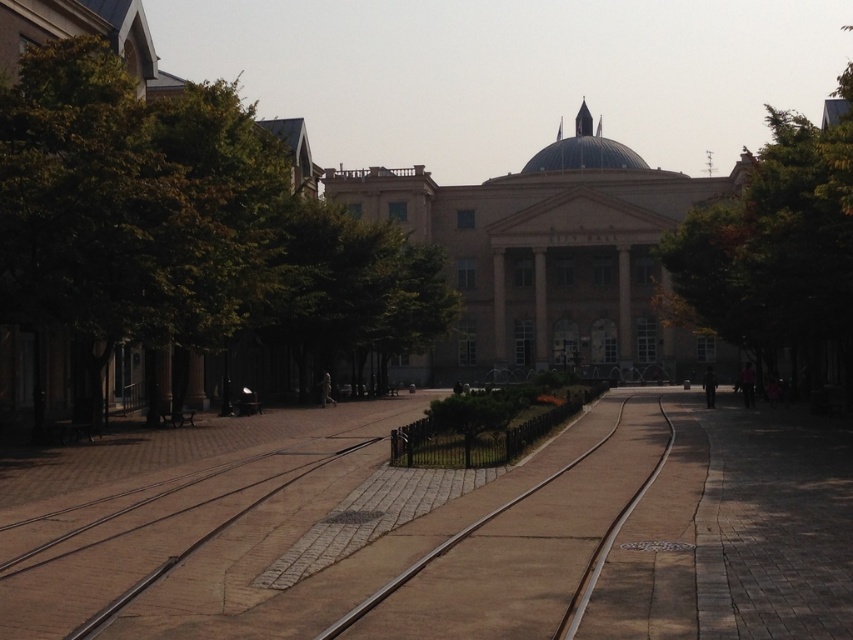
Question: Can you confirm if green leafy tree at upper right is thinner than brown concrete train track at center?

Choices:
 (A) no
 (B) yes

Answer: (A)

Question: Can you confirm if green leafy tree at left is smaller than brown concrete train track at center?

Choices:
 (A) no
 (B) yes

Answer: (A)

Question: Which object appears closest to the camera in this image?

Choices:
 (A) green leafy tree at left
 (B) transparent glass dome at center
 (C) green leafy tree at upper right
 (D) brown concrete train track at center

Answer: (D)

Question: Does brown concrete train track at center have a lesser width compared to transparent glass dome at center?

Choices:
 (A) yes
 (B) no

Answer: (A)

Question: Based on their relative distances, which object is farther from the transparent glass dome at center?

Choices:
 (A) green leafy tree at left
 (B) green leafy tree at upper right

Answer: (A)

Question: Which object appears farthest from the camera in this image?

Choices:
 (A) brown concrete train track at center
 (B) transparent glass dome at center

Answer: (B)